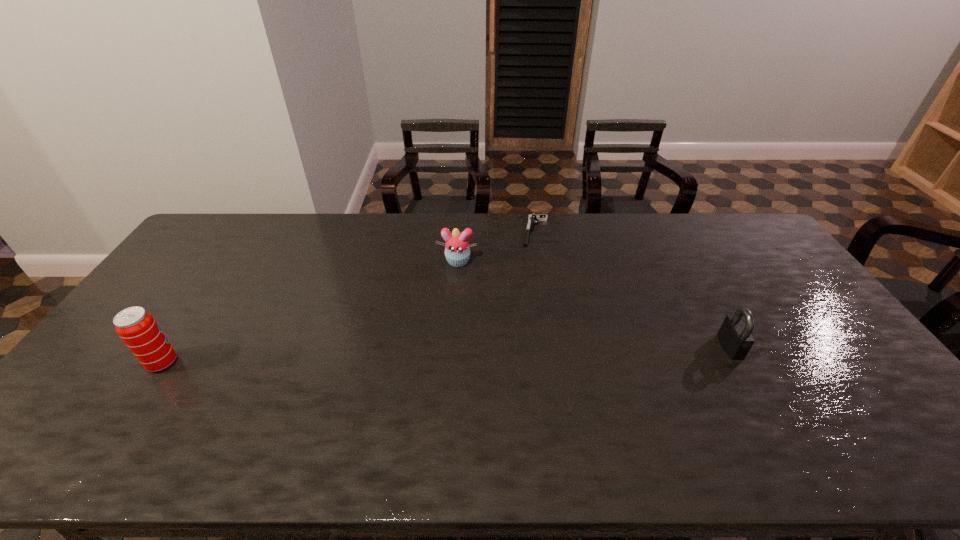
Find the location of a particular element. free spot at the right edge of the desktop is located at coordinates (796, 307).

Locate an element on the screen. The height and width of the screenshot is (540, 960). free spot at the near left corner of the desktop is located at coordinates (75, 414).

Where is `free region at the far right corner of the desktop`? The width and height of the screenshot is (960, 540). free region at the far right corner of the desktop is located at coordinates (762, 242).

This screenshot has width=960, height=540. Identify the location of free space between the soda can and the padlock. (446, 354).

Find the location of a particular element. This screenshot has height=540, width=960. unoccupied position between the pistol and the leftmost object is located at coordinates (348, 297).

This screenshot has height=540, width=960. I want to click on free space that is in between the cupcake and the pistol, so click(496, 246).

Where is `free area in between the farthest object and the rightmost object`? The height and width of the screenshot is (540, 960). free area in between the farthest object and the rightmost object is located at coordinates (633, 289).

Locate an element on the screen. Image resolution: width=960 pixels, height=540 pixels. free spot between the third nearest object and the rightmost object is located at coordinates (594, 304).

Where is `empty space between the third object from left to right and the leftmost object`? The width and height of the screenshot is (960, 540). empty space between the third object from left to right and the leftmost object is located at coordinates (348, 297).

The image size is (960, 540). What are the coordinates of `vacant space that's between the shortest object and the tallest object` in the screenshot? It's located at (348, 297).